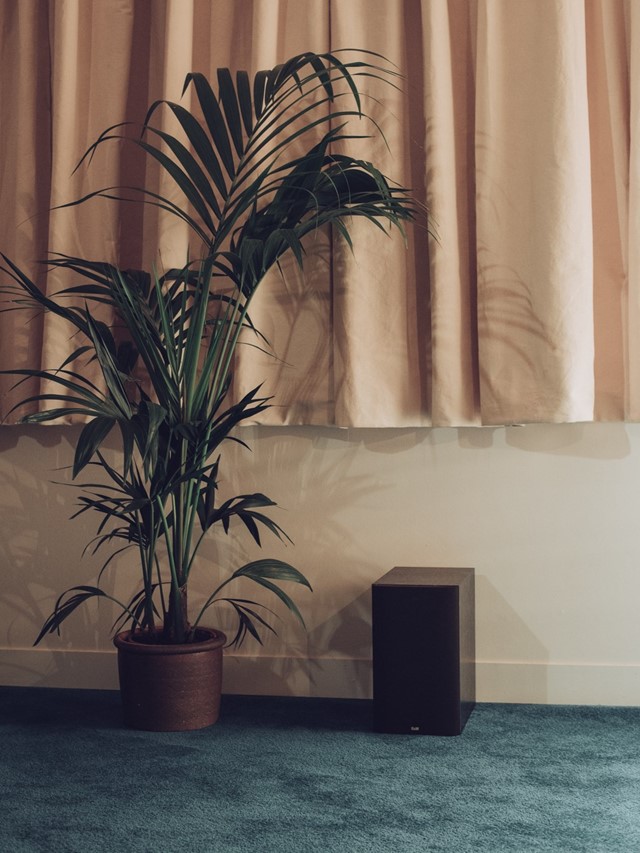
Identify the location of wall. (532, 535).